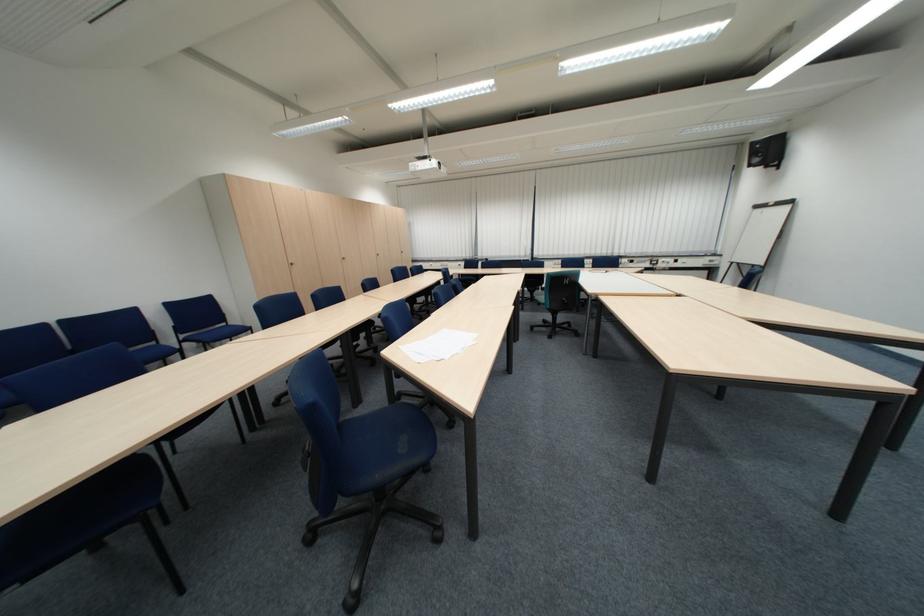
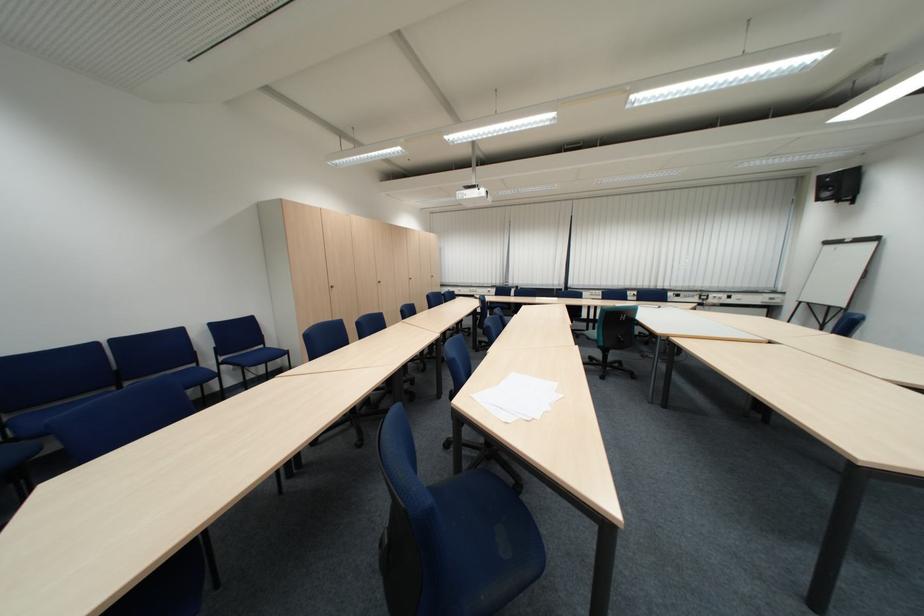
Question: The images are taken continuously from a first-person perspective. In which direction is your viewpoint rotating?

Choices:
 (A) Left
 (B) Right
 (C) Up
 (D) Down

Answer: (C)